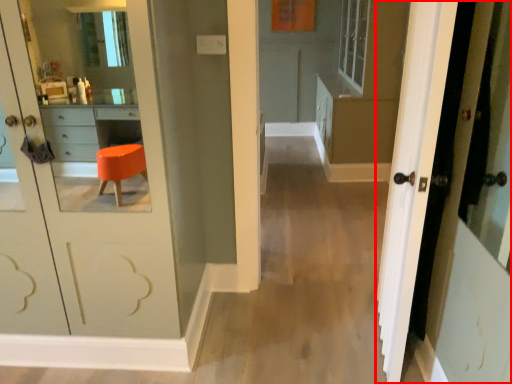
Question: Where is door (annotated by the red box) located in relation to dresser in the image?

Choices:
 (A) left
 (B) right

Answer: (A)